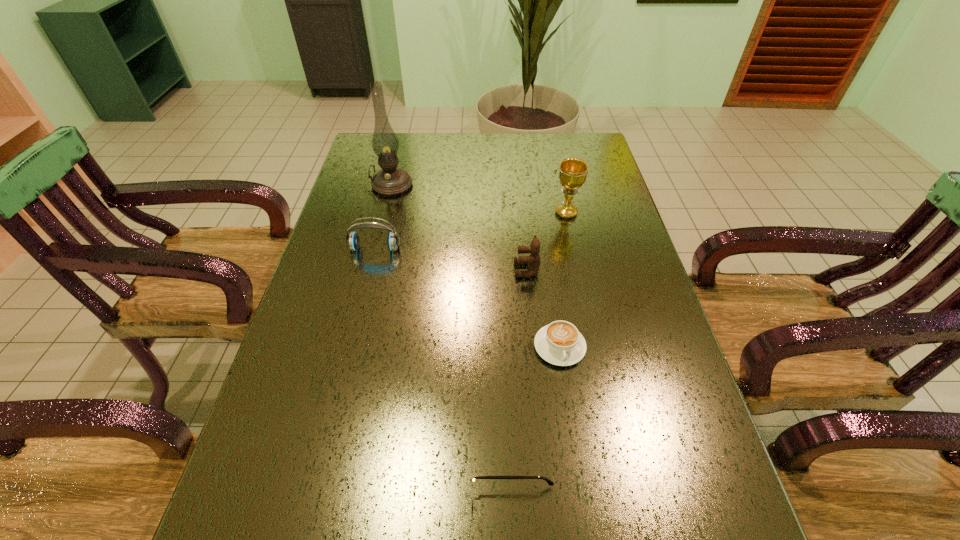
The width and height of the screenshot is (960, 540). I want to click on the tallest object, so click(390, 181).

You are a GUI agent. You are given a task and a screenshot of the screen. Output one action in this format:
    pyautogui.click(x=<x>, y=<y>)
    Task: Click on the farthest object
    
    Given the screenshot: What is the action you would take?
    pyautogui.click(x=390, y=181)

This screenshot has height=540, width=960. What are the coordinates of `chalice` in the screenshot? It's located at (572, 171).

Image resolution: width=960 pixels, height=540 pixels. In order to click on the second tallest object in this screenshot , I will do pyautogui.click(x=572, y=171).

Locate an element on the screen. teddy bear is located at coordinates click(533, 260).

In order to click on the third farthest object in this screenshot , I will do `click(353, 241)`.

Where is `the second nearest object`? The image size is (960, 540). the second nearest object is located at coordinates (560, 343).

Where is `vacant position located on the front of the farthest object`? The width and height of the screenshot is (960, 540). vacant position located on the front of the farthest object is located at coordinates (369, 280).

Locate an element on the screen. vacant space located on the right of the second tallest object is located at coordinates (596, 213).

Where is `vacant region located on the face of the teddy bear`? vacant region located on the face of the teddy bear is located at coordinates (449, 270).